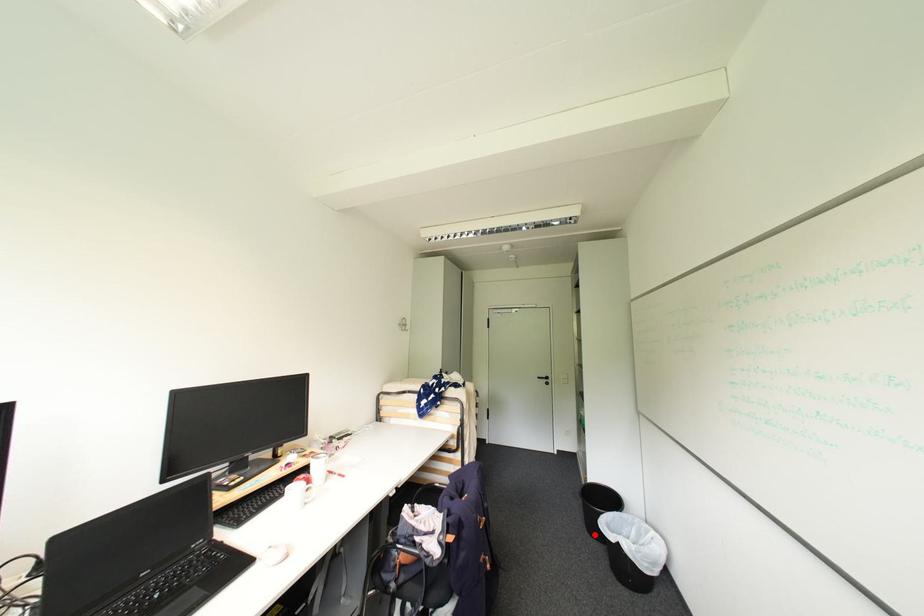
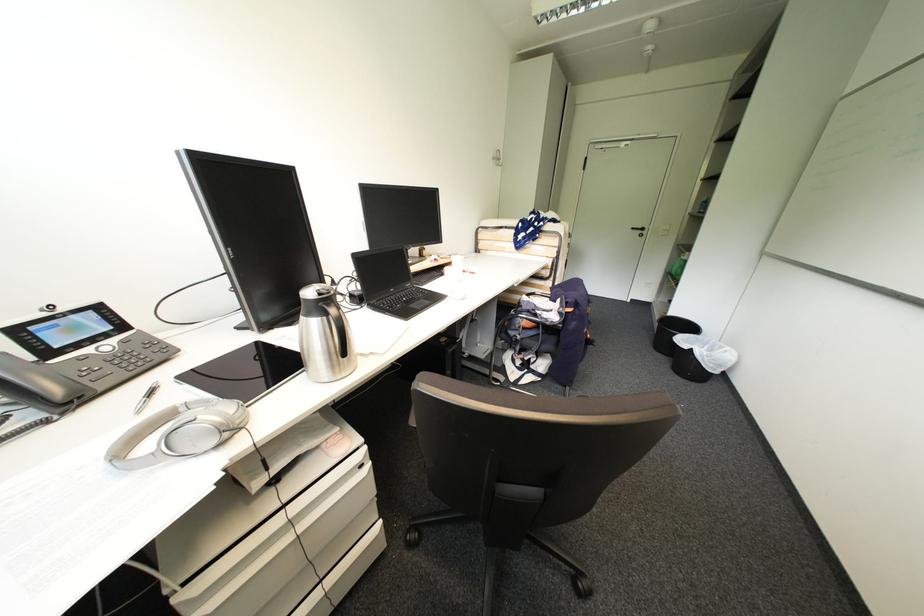
In the second image, find the point that corresponds to the highlighted location in the first image.

(660, 351)